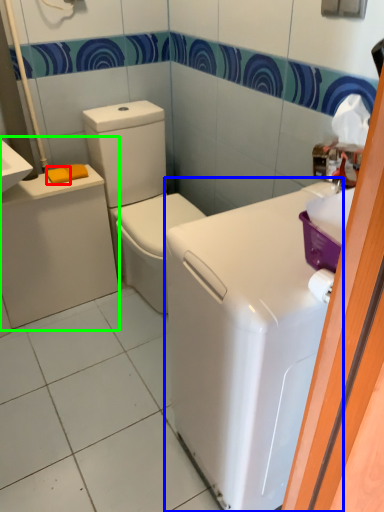
Question: Based on their relative distances, which object is nearer to soap (highlighted by a red box)? Choose from appliance (highlighted by a blue box) and porcelain (highlighted by a green box).

Choices:
 (A) appliance
 (B) porcelain

Answer: (B)